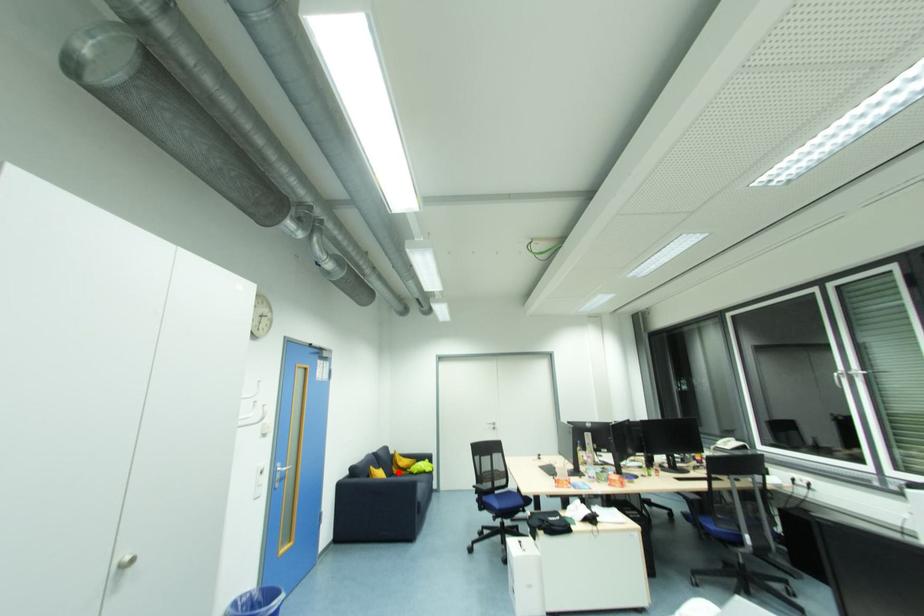
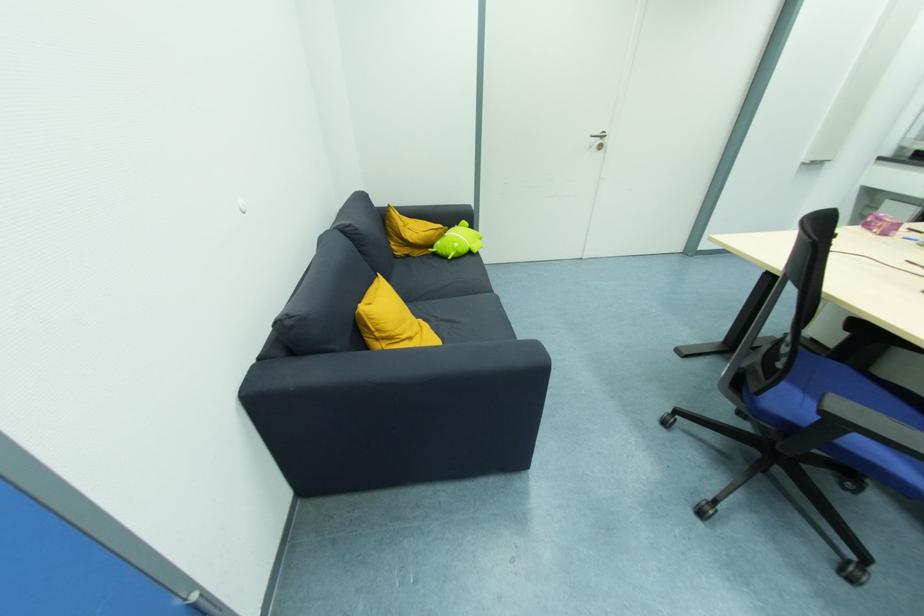
Find the pixel in the second image that matches the highlighted location in the first image.

(403, 253)